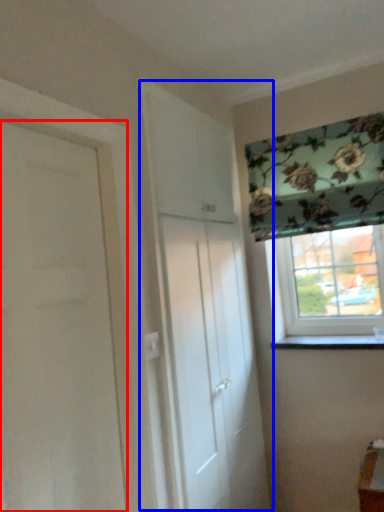
Question: Which of the following is the closest to the observer, door (highlighted by a red box) or door (highlighted by a blue box)?

Choices:
 (A) door
 (B) door

Answer: (A)